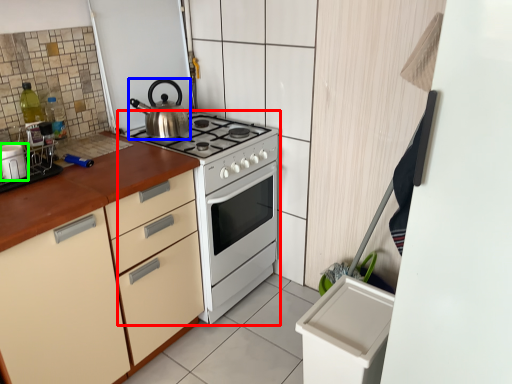
Question: Which is nearer to the appliance (highlighted by a red box)? kettle (highlighted by a blue box) or kitchen appliance (highlighted by a green box).

Choices:
 (A) kettle
 (B) kitchen appliance

Answer: (A)